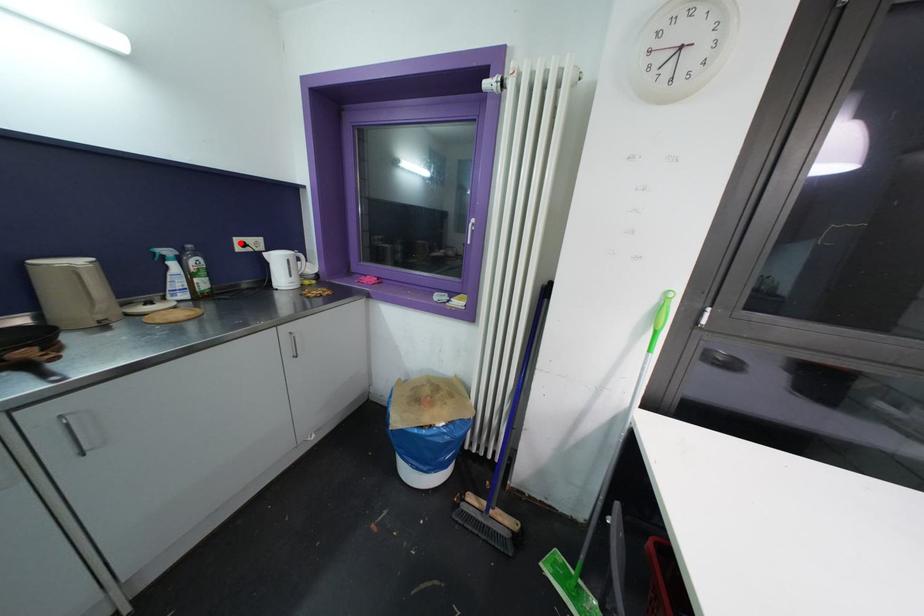
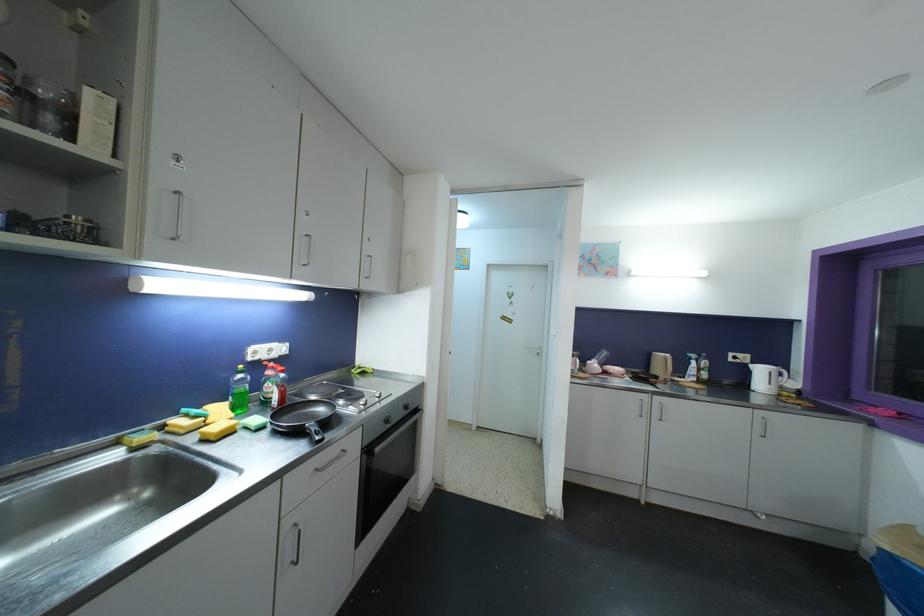
In the second image, find the point that corresponds to the highlighted location in the first image.

(734, 357)